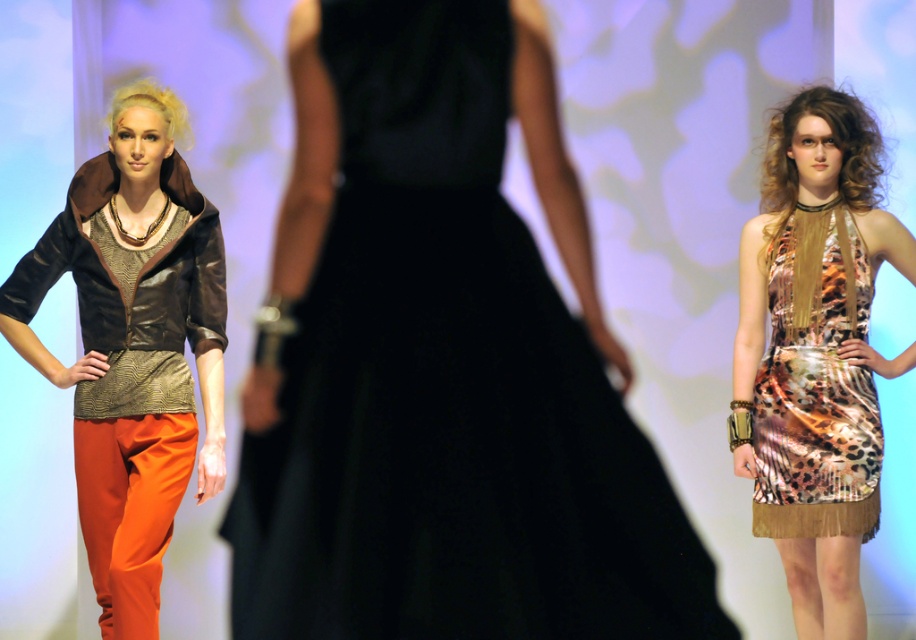
Between point (136, 468) and point (751, 260), which one is positioned in front?

Positioned in front is point (136, 468).

Is matte brown leather jacket at left closer to camera compared to leopard print dress at right?

Yes, matte brown leather jacket at left is closer to the viewer.

Which is in front, point (100, 435) or point (773, 528)?

Positioned in front is point (100, 435).

Locate an element on the screen. matte brown leather jacket at left is located at coordinates (133, 346).

Can you confirm if leopard print dress at right is positioned below leopard print satin dress at right?

No, leopard print dress at right is not below leopard print satin dress at right.

Which is in front, point (745, 312) or point (836, 205)?

Point (836, 205) is more forward.

Where is `leopard print dress at right`? leopard print dress at right is located at coordinates (815, 353).

Who is positioned more to the left, matte brown leather jacket at left or leopard print satin dress at right?

Positioned to the left is matte brown leather jacket at left.

Between point (147, 410) and point (864, 538), which one is positioned in front?

Point (147, 410)

Which is in front, point (105, 328) or point (826, 445)?

Positioned in front is point (105, 328).

Find the location of a particular element. matte brown leather jacket at left is located at coordinates (133, 346).